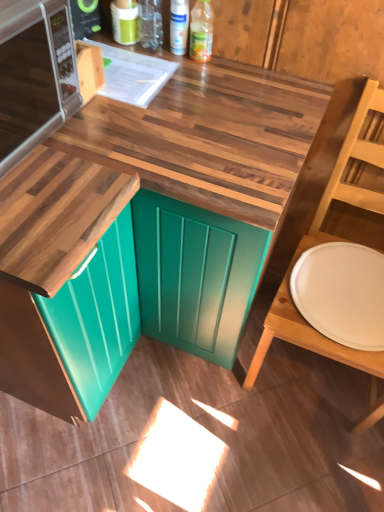
Question: Is teal glossy cabinet at lower left aimed at wooden at center?

Choices:
 (A) no
 (B) yes

Answer: (A)

Question: Is wooden at center located within teal glossy cabinet at lower left?

Choices:
 (A) no
 (B) yes

Answer: (A)

Question: Are teal glossy cabinet at lower left and wooden at center located far from each other?

Choices:
 (A) yes
 (B) no

Answer: (B)

Question: Is teal glossy cabinet at lower left turned away from wooden at center?

Choices:
 (A) no
 (B) yes

Answer: (A)

Question: Is teal glossy cabinet at lower left outside wooden at center?

Choices:
 (A) no
 (B) yes

Answer: (B)

Question: In terms of height, does wooden at center look taller or shorter compared to translucent plastic bottle at upper center, which is the second bottle in left-to-right order?

Choices:
 (A) tall
 (B) short

Answer: (A)

Question: Is wooden at center bigger or smaller than translucent plastic bottle at upper center, which is the second bottle in left-to-right order?

Choices:
 (A) small
 (B) big

Answer: (B)

Question: Is wooden at center in front of or behind translucent plastic bottle at upper center, which is the second bottle in left-to-right order, in the image?

Choices:
 (A) front
 (B) behind

Answer: (A)

Question: From a real-world perspective, relative to translucent plastic bottle at upper center, which is the second bottle in left-to-right order, is wooden at center vertically above or below?

Choices:
 (A) below
 (B) above

Answer: (A)

Question: Based on their sizes in the image, would you say white glossy spray can at upper center, positioned as the second bottle in right-to-left order, is bigger or smaller than silver metallic microwave at upper left?

Choices:
 (A) small
 (B) big

Answer: (A)

Question: In terms of height, does white glossy spray can at upper center, positioned as the second bottle in right-to-left order, look taller or shorter compared to silver metallic microwave at upper left?

Choices:
 (A) tall
 (B) short

Answer: (B)

Question: Is white glossy spray can at upper center, positioned as the second bottle in right-to-left order, to the left or to the right of silver metallic microwave at upper left in the image?

Choices:
 (A) left
 (B) right

Answer: (B)

Question: From the image's perspective, is white glossy spray can at upper center, positioned as the second bottle in right-to-left order, positioned above or below silver metallic microwave at upper left?

Choices:
 (A) below
 (B) above

Answer: (B)

Question: From a real-world perspective, is teal glossy cabinet at lower left physically located above or below wooden at center?

Choices:
 (A) above
 (B) below

Answer: (B)

Question: In the image, is teal glossy cabinet at lower left positioned in front of or behind wooden at center?

Choices:
 (A) behind
 (B) front

Answer: (B)